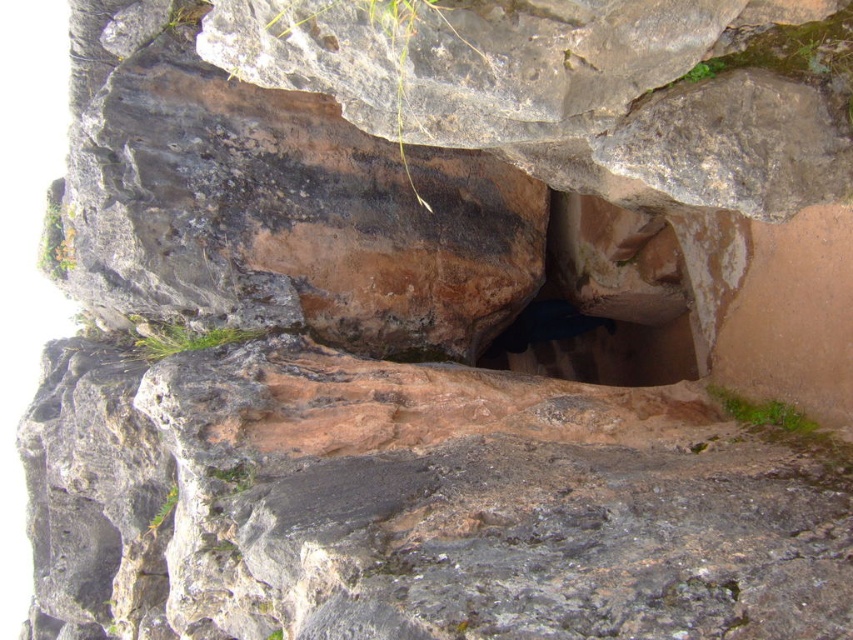
Question: Which point is closer to the camera?

Choices:
 (A) (653, 362)
 (B) (595, 273)

Answer: (B)

Question: Can you confirm if brown stone staircase at center is positioned to the left of dark brown stone hole at center?

Choices:
 (A) yes
 (B) no

Answer: (B)

Question: Where is brown stone staircase at center located in relation to dark brown stone hole at center in the image?

Choices:
 (A) above
 (B) below

Answer: (A)

Question: Does brown stone staircase at center have a greater width compared to dark brown stone hole at center?

Choices:
 (A) yes
 (B) no

Answer: (B)

Question: Which object appears closest to the camera in this image?

Choices:
 (A) dark brown stone hole at center
 (B) brown stone staircase at center

Answer: (B)

Question: Which object is farther from the camera taking this photo?

Choices:
 (A) brown stone staircase at center
 (B) dark brown stone hole at center

Answer: (B)